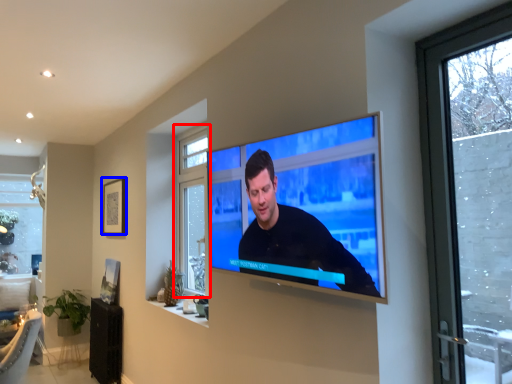
Question: Which of the following is the farthest to the observer, window (highlighted by a red box) or picture frame (highlighted by a blue box)?

Choices:
 (A) window
 (B) picture frame

Answer: (B)